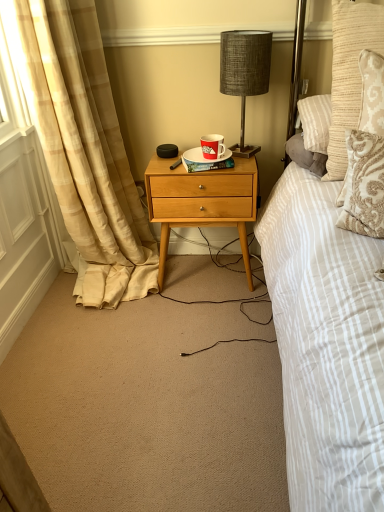
Locate an element on the screen. The width and height of the screenshot is (384, 512). vacant area located to the right-hand side of red paper cup at center is located at coordinates (240, 157).